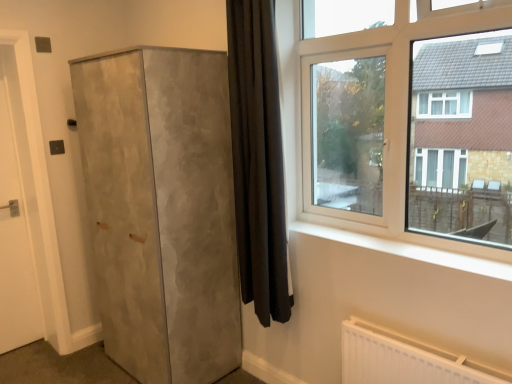
Question: Does white matte door at left turn towards black velvet curtain at center?

Choices:
 (A) no
 (B) yes

Answer: (A)

Question: Can you confirm if white matte door at left is bigger than black velvet curtain at center?

Choices:
 (A) no
 (B) yes

Answer: (A)

Question: Can you confirm if white matte door at left is smaller than black velvet curtain at center?

Choices:
 (A) no
 (B) yes

Answer: (B)

Question: Is white matte door at left positioned before black velvet curtain at center?

Choices:
 (A) no
 (B) yes

Answer: (A)

Question: From the image's perspective, would you say white matte door at left is shown under black velvet curtain at center?

Choices:
 (A) no
 (B) yes

Answer: (B)

Question: Does white matte door at left come behind black velvet curtain at center?

Choices:
 (A) yes
 (B) no

Answer: (A)

Question: Is clear glass window at upper right facing away from black velvet curtain at center?

Choices:
 (A) no
 (B) yes

Answer: (A)

Question: Does clear glass window at upper right have a lesser width compared to black velvet curtain at center?

Choices:
 (A) yes
 (B) no

Answer: (B)

Question: Can we say clear glass window at upper right lies outside black velvet curtain at center?

Choices:
 (A) no
 (B) yes

Answer: (B)

Question: From a real-world perspective, is clear glass window at upper right positioned over black velvet curtain at center based on gravity?

Choices:
 (A) no
 (B) yes

Answer: (B)

Question: Considering the relative positions of clear glass window at upper right and black velvet curtain at center in the image provided, is clear glass window at upper right to the right of black velvet curtain at center from the viewer's perspective?

Choices:
 (A) no
 (B) yes

Answer: (B)

Question: Does clear glass window at upper right have a greater height compared to black velvet curtain at center?

Choices:
 (A) yes
 (B) no

Answer: (B)

Question: From the image's perspective, would you say white matte door at left is shown under matte concrete cupboard at left?

Choices:
 (A) yes
 (B) no

Answer: (B)